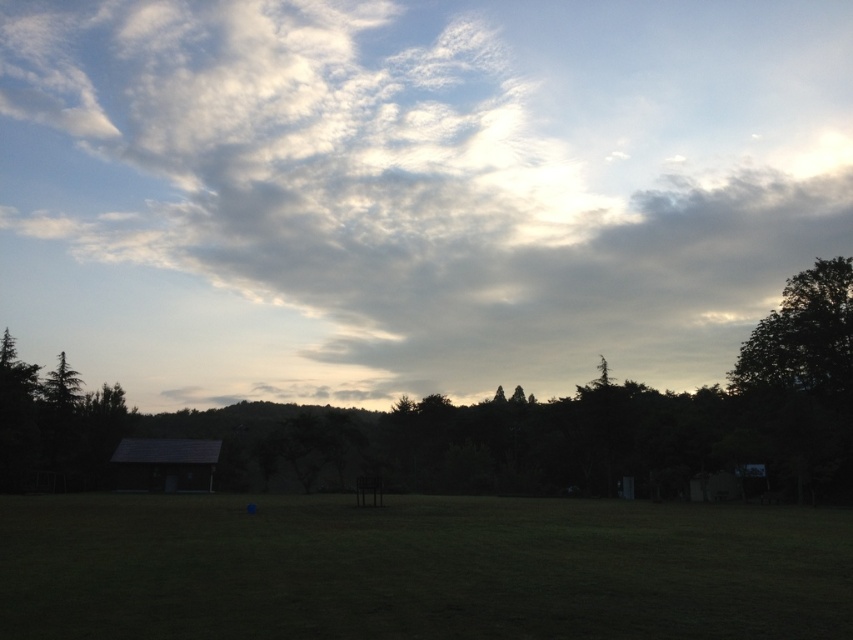
You are an observer standing in front of the forest. You see the green leafy tree at center and the dark green leafy tree at right. Which tree is closer to you?

The green leafy tree at center is positioned under the dark green leafy tree at right, so the dark green leafy tree at right is closer to you.

You are standing in the serene outdoor scene and want to walk from the point at coordinates (621, 445) to the point at (828, 419). Given that both points are on the ground, which direction should you face to move towards the second point?

To move from point (621, 445) to point (828, 419), you should face downward because point (828, 419) is further away from the viewer compared to point (621, 445).